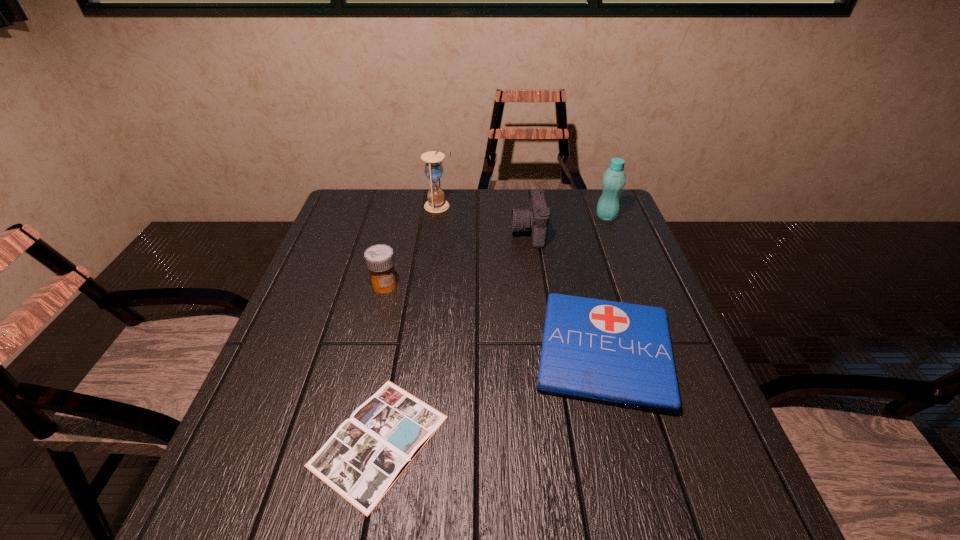
Locate an element on the screen. This screenshot has height=540, width=960. vacant space that's between the medicine and the book is located at coordinates (382, 363).

At what (x,y) coordinates should I click in order to perform the action: click on free point between the first-aid kit and the third nearest object. Please return your answer as a coordinate pair (x, y). Looking at the image, I should click on (494, 319).

Find the location of a particular element. This screenshot has width=960, height=540. free space between the first-aid kit and the hourglass is located at coordinates (521, 279).

The width and height of the screenshot is (960, 540). In order to click on vacant space that is in between the first-aid kit and the third nearest object in this screenshot , I will do `click(494, 319)`.

Find the location of `free area in between the camera and the bottle`. free area in between the camera and the bottle is located at coordinates (567, 224).

Find the location of a particular element. This screenshot has height=540, width=960. vacant point located between the bottle and the medicine is located at coordinates (495, 251).

The height and width of the screenshot is (540, 960). I want to click on free area in between the hourglass and the second shortest object, so click(x=521, y=279).

You are a GUI agent. You are given a task and a screenshot of the screen. Output one action in this format:
    pyautogui.click(x=<x>, y=<y>)
    Task: Click on the vacant point located between the first-aid kit and the hourglass
    The height and width of the screenshot is (540, 960).
    Given the screenshot: What is the action you would take?
    pyautogui.click(x=521, y=279)

Where is `the second closest object to the bottle`? This screenshot has width=960, height=540. the second closest object to the bottle is located at coordinates (616, 353).

At what (x,y) coordinates should I click in order to perform the action: click on object that is the second nearest to the bottle. Please return your answer as a coordinate pair (x, y). The width and height of the screenshot is (960, 540). Looking at the image, I should click on (616, 353).